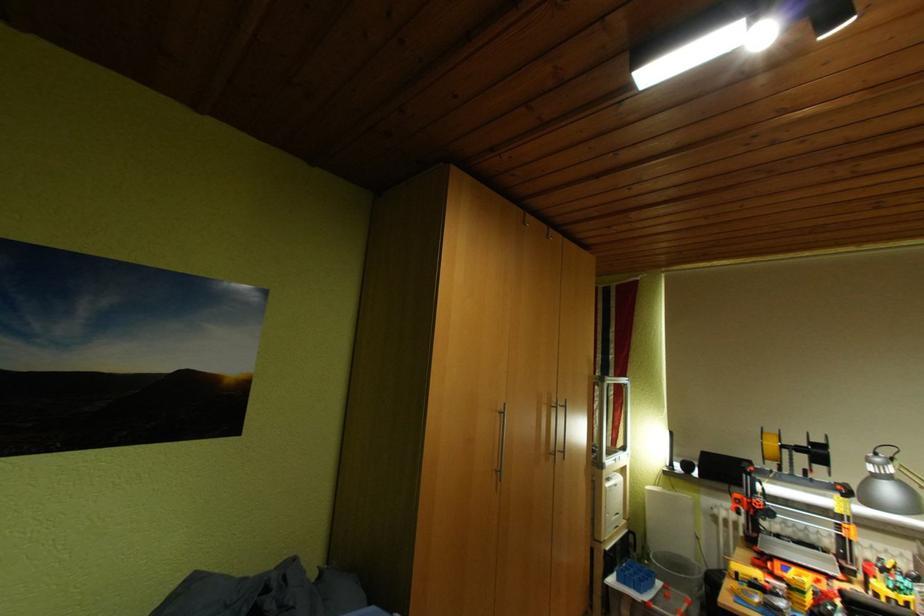
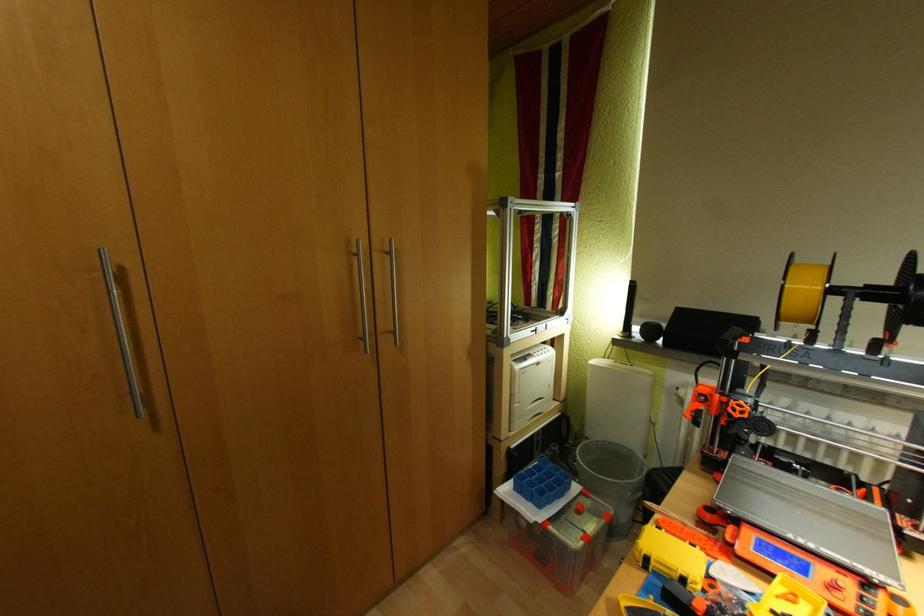
In a continuous first-person perspective shot, in which direction is the camera moving?

The cameraman moved toward right, forward.